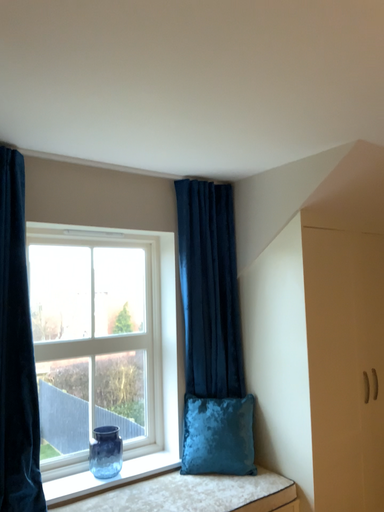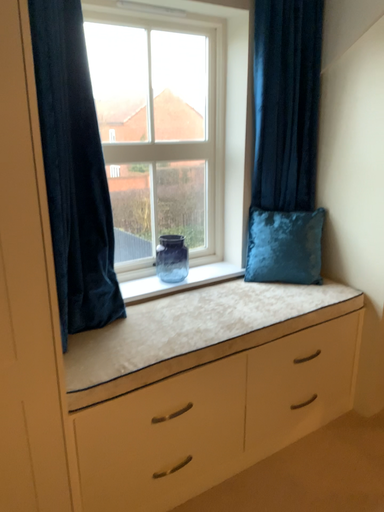
Question: How did the camera likely rotate when shooting the video?

Choices:
 (A) rotated upward
 (B) rotated downward

Answer: (B)